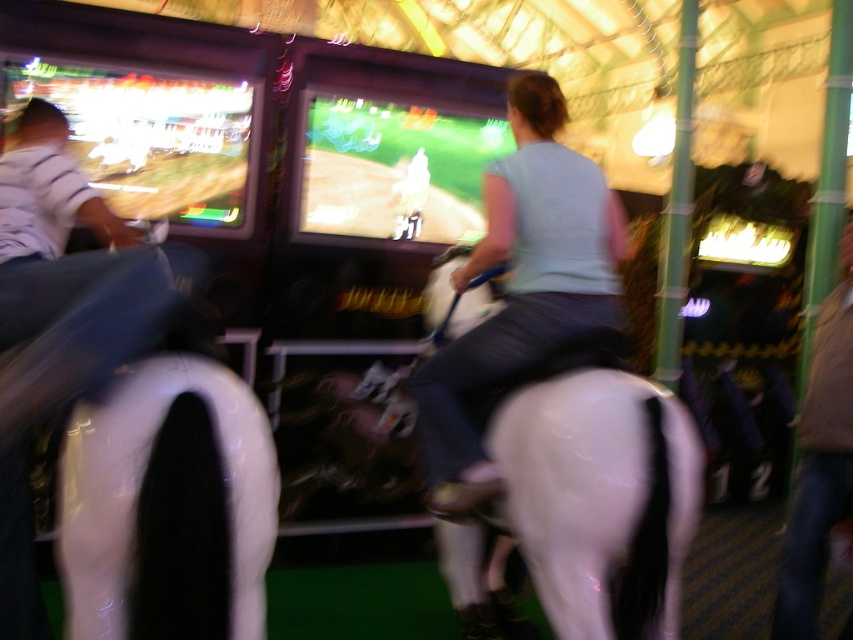
You are standing in the amusement park and want to join the horse riding game. The game requires you to sit on the white glossy horse at center and push the button next to the brown leather jacket at lower right. Can you reach the button from your seated position on the horse?

The white glossy horse at center is positioned on the left side of brown leather jacket at lower right, so you can reach the button next to the brown leather jacket at lower right from the seated position on the horse.